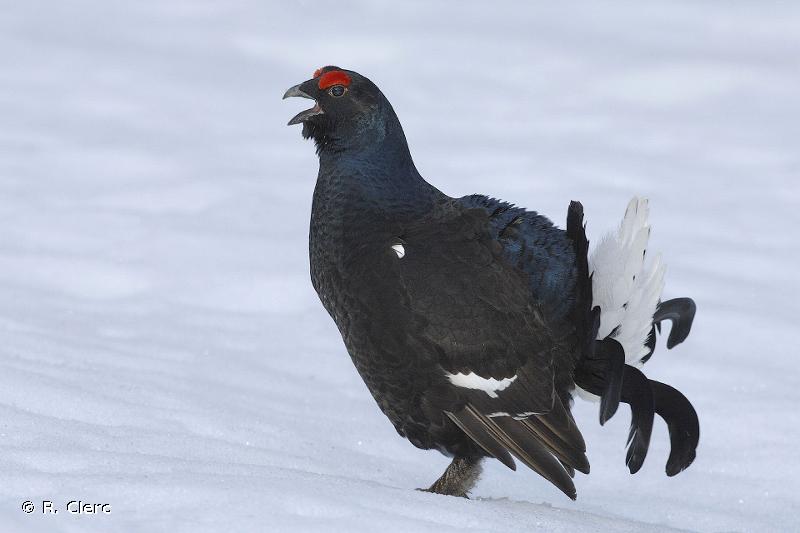
Where is `corner`? corner is located at coordinates (x=84, y=499).